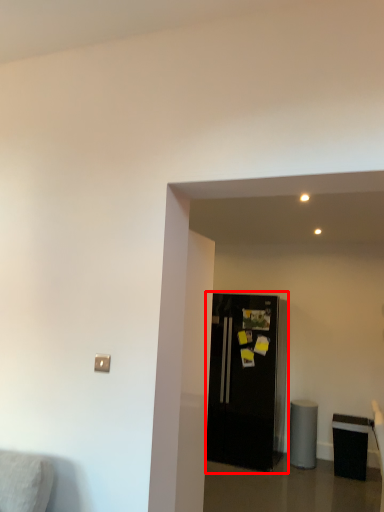
Question: From the image, what is the correct spatial relationship of refrigerator (annotated by the red box) in relation to furniture?

Choices:
 (A) left
 (B) right

Answer: (A)